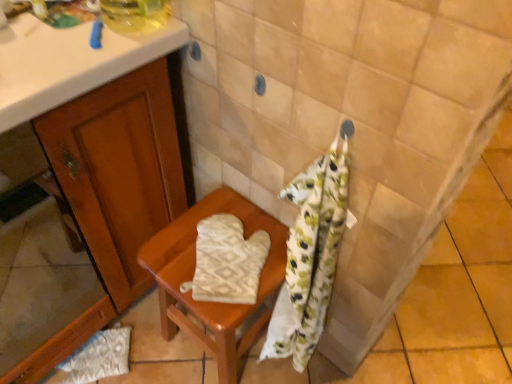
Locate an element on the screen. vacant space situated above beige fabric oven mitt at center (from a real-world perspective) is located at coordinates (219, 266).